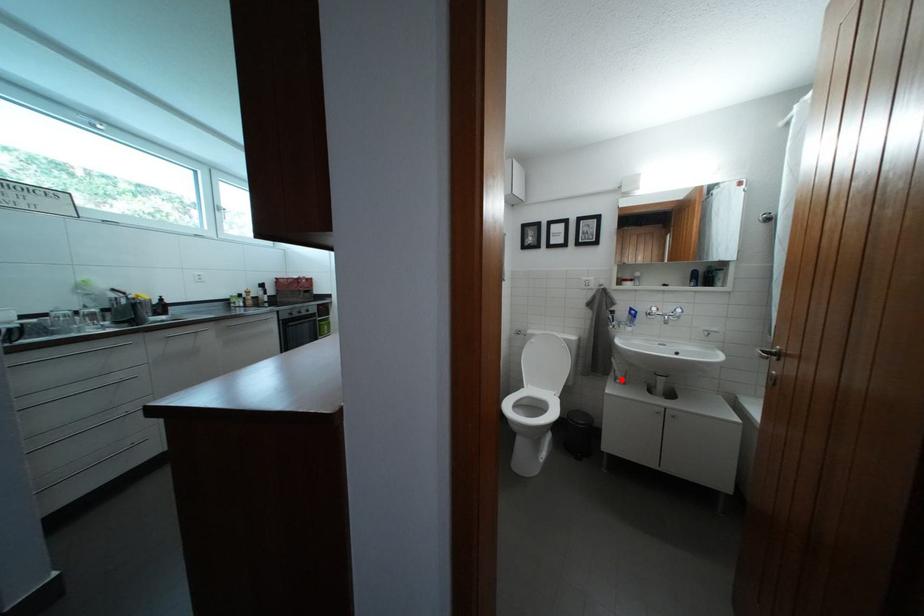
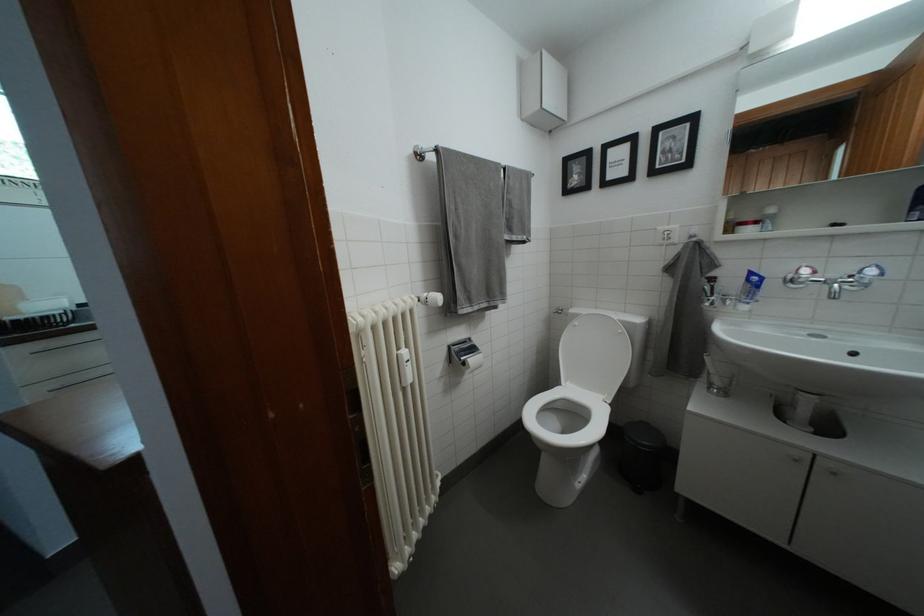
Question: A red point is marked in image1. In image2, is the corresponding 3D point closer to the camera or farther? Reply with the corresponding letter.

Choices:
 (A) The corresponding 3D point is closer.
 (B) The corresponding 3D point is farther.

Answer: (A)